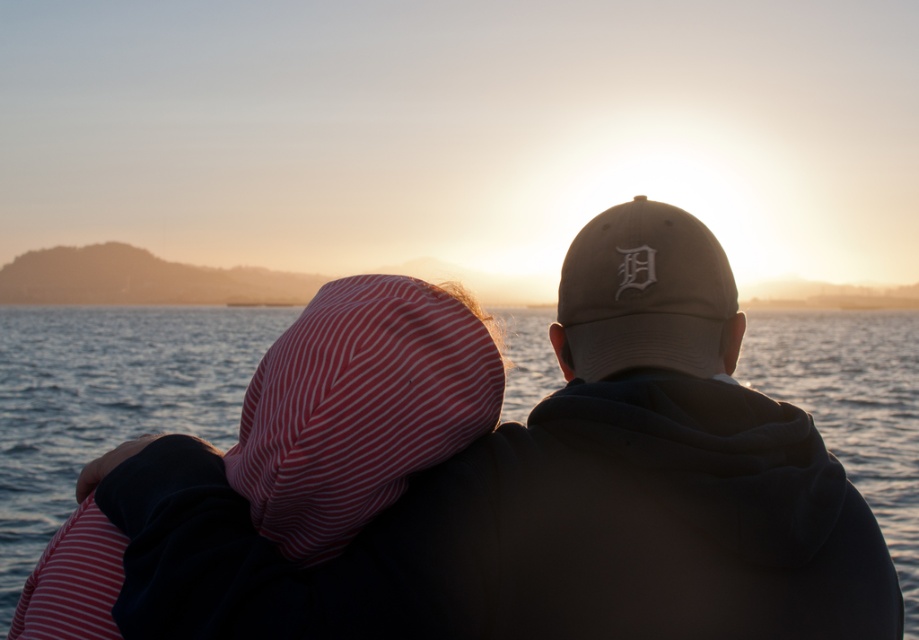
Can you confirm if khaki fabric cap at upper right is positioned below blue water at center?

Actually, khaki fabric cap at upper right is above blue water at center.

Which is below, khaki fabric cap at upper right or blue water at center?

blue water at center is lower down.

I want to click on khaki fabric cap at upper right, so click(674, 465).